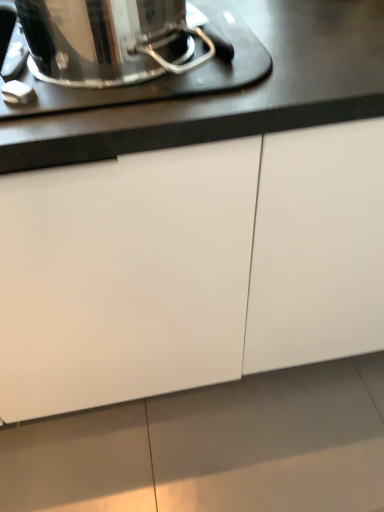
Question: Is white matte cabinet at center to the left or to the right of white glossy tile at lower center in the image?

Choices:
 (A) right
 (B) left

Answer: (B)

Question: From the image's perspective, is white matte cabinet at center positioned above or below white glossy tile at lower center?

Choices:
 (A) above
 (B) below

Answer: (A)

Question: Based on their relative distances, which object is farther from the white glossy tile at lower center?

Choices:
 (A) polished stainless steel pot at upper left
 (B) white matte cabinet at center

Answer: (A)

Question: Which object is positioned farthest from the white matte cabinet at center?

Choices:
 (A) polished stainless steel pot at upper left
 (B) white glossy tile at lower center

Answer: (B)